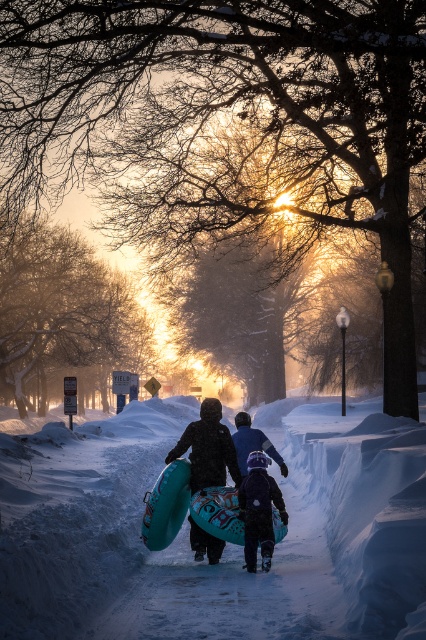
You are standing at the point labeled point (250, 566) and want to walk to the point labeled point (100, 541). Which direction should you move relative to the scene?

You should move forward towards the direction of the glowing sun since point (100, 541) is in front of point (250, 566) in the scene.